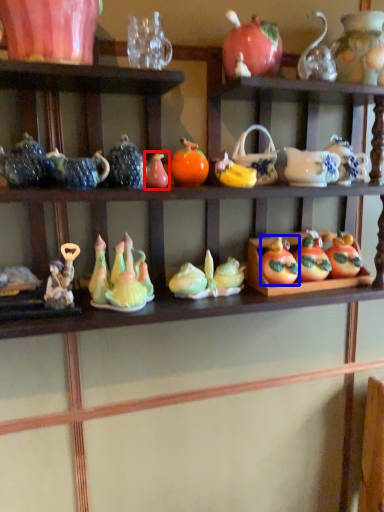
Question: Among these objects, which one is farthest to the camera, toy (highlighted by a red box) or fruit (highlighted by a blue box)?

Choices:
 (A) toy
 (B) fruit

Answer: (B)